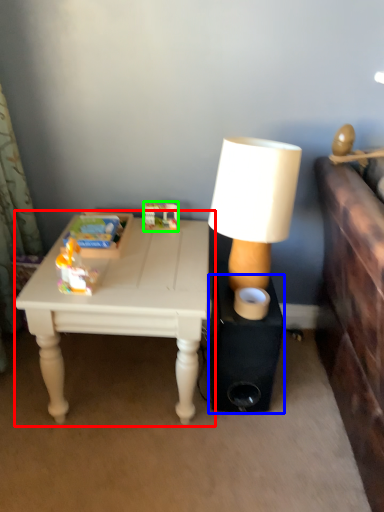
Question: Which object is the closest to the table (highlighted by a red box)? Choose among these: speaker (highlighted by a blue box) or toy (highlighted by a green box).

Choices:
 (A) speaker
 (B) toy

Answer: (A)